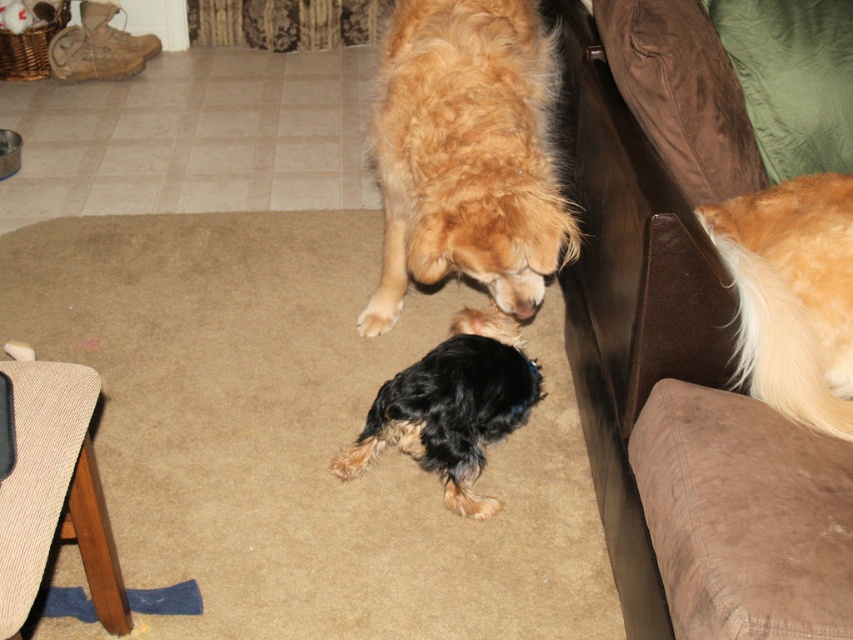
Is point (741, 209) behind point (392, 317)?

No, (741, 209) is closer to viewer.

You are a GUI agent. You are given a task and a screenshot of the screen. Output one action in this format:
    pyautogui.click(x=<x>, y=<y>)
    Task: Click on the golden fur dog at right
    
    Given the screenshot: What is the action you would take?
    pyautogui.click(x=793, y=294)

Consider the image. Does black silky dog at center have a lesser height compared to light brown fur at center?

No, black silky dog at center is not shorter than light brown fur at center.

Does point (375, 413) come farther from viewer compared to point (373, 333)?

No, (375, 413) is in front of (373, 333).

Does point (386, 381) come behind point (393, 307)?

No, it is not.

Where is `black silky dog at center`? black silky dog at center is located at coordinates [451, 406].

Is golden fur dog at center bigger than black silky dog at center?

Correct, golden fur dog at center is larger in size than black silky dog at center.

From the picture: Between golden fur dog at center and black silky dog at center, which one is positioned lower?

black silky dog at center

Which is in front, point (498, 161) or point (532, 372)?

Point (498, 161) is more forward.

You are a GUI agent. You are given a task and a screenshot of the screen. Output one action in this format:
    pyautogui.click(x=<x>, y=<y>)
    Task: Click on the golden fur dog at center
    The width and height of the screenshot is (853, 640).
    Given the screenshot: What is the action you would take?
    pyautogui.click(x=469, y=148)